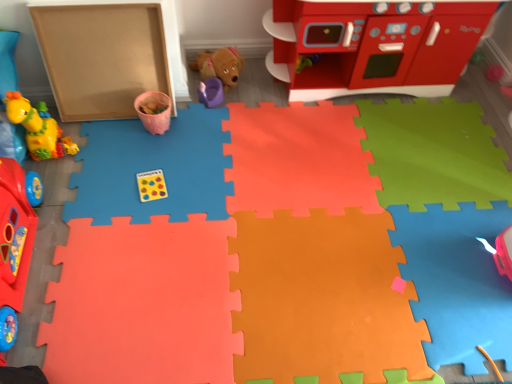
Where is `vacant point to the right of pink matte cup at upper center, acting as the third toy starting from the left`? This screenshot has width=512, height=384. vacant point to the right of pink matte cup at upper center, acting as the third toy starting from the left is located at coordinates (195, 132).